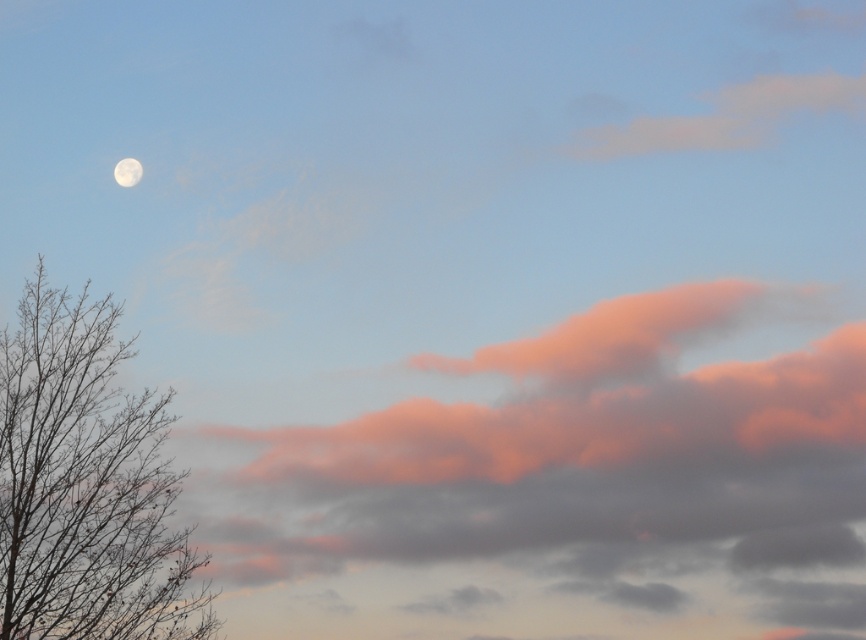
Question: Can you confirm if bare branches at left is smaller than white fluffy cloud at upper left?

Choices:
 (A) yes
 (B) no

Answer: (B)

Question: Among these objects, which one is farthest from the camera?

Choices:
 (A) white fluffy cloud at upper left
 (B) bare branches at left

Answer: (A)

Question: Is bare branches at left positioned before white fluffy cloud at upper left?

Choices:
 (A) yes
 (B) no

Answer: (A)

Question: Which point is closer to the camera taking this photo?

Choices:
 (A) (124, 166)
 (B) (79, 392)

Answer: (B)

Question: Can you confirm if bare branches at left is wider than white fluffy cloud at upper left?

Choices:
 (A) no
 (B) yes

Answer: (B)